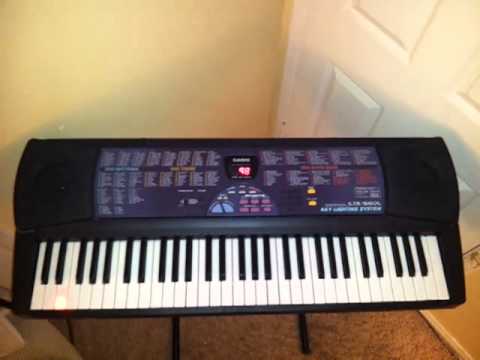
Identify the location of door. (410, 101).